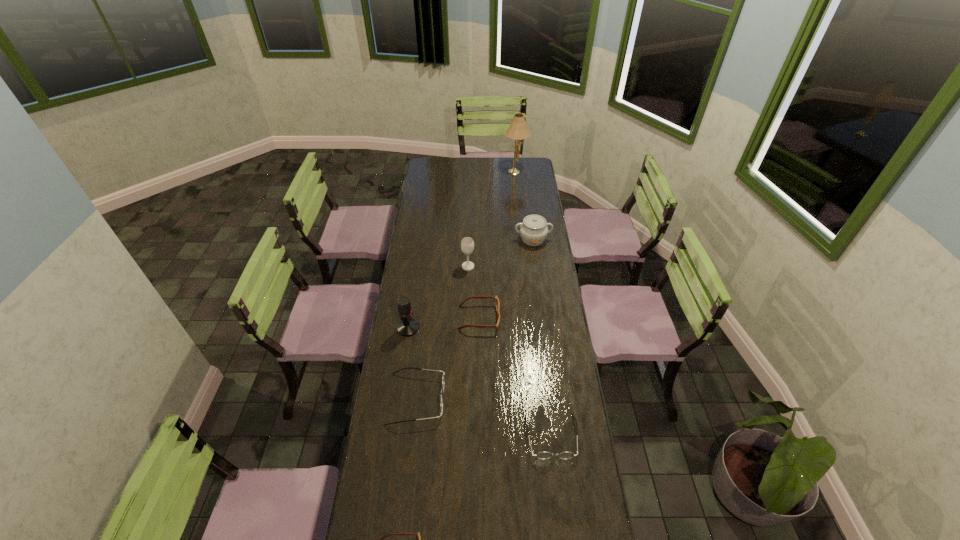
At what (x,y) coordinates should I click in order to perform the action: click on the right dark spectacles. Please return your answer as a coordinate pair (x, y). The width and height of the screenshot is (960, 540). Looking at the image, I should click on [542, 455].

What are the coordinates of `the smaller dark spectacles` in the screenshot? It's located at (542, 455).

Identify the location of vacant area situated on the back of the lampshade. This screenshot has height=540, width=960. (515, 157).

This screenshot has width=960, height=540. In order to click on vacant space located on the side of the red microphone with the red ring in this screenshot , I will do `click(438, 328)`.

At what (x,y) coordinates should I click in order to perform the action: click on free space located 0.070m on the right of the wineglass. Please return your answer as a coordinate pair (x, y). This screenshot has height=540, width=960. Looking at the image, I should click on (489, 267).

Identify the location of vacant space situated on the front of the white chinaware. (536, 259).

Image resolution: width=960 pixels, height=540 pixels. In order to click on vacant area situated through the lenses of the fifth tallest object in this screenshot , I will do `click(485, 399)`.

At what (x,y) coordinates should I click in order to perform the action: click on vacant space located on the front-facing side of the right brown spectacles. Please return your answer as a coordinate pair (x, y). The height and width of the screenshot is (540, 960). Looking at the image, I should click on (539, 318).

Identify the location of free space located 0.210m through the lenses of the smaller dark spectacles. (563, 530).

Find the location of `object that is at the far edge`. object that is at the far edge is located at coordinates (518, 130).